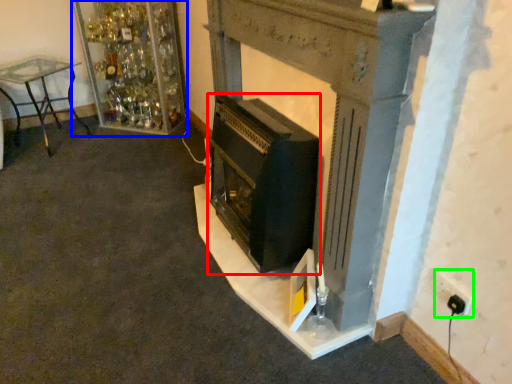
Question: Considering the real-world distances, which object is farthest from wood burning stove (highlighted by a red box)? shelf (highlighted by a blue box) or electric outlet (highlighted by a green box)?

Choices:
 (A) shelf
 (B) electric outlet

Answer: (A)